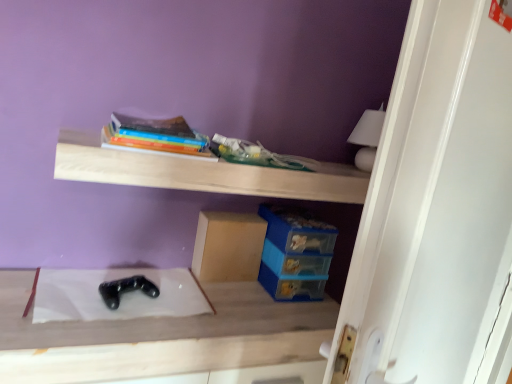
Where is `free spot in front of matte cardboard box at center`? This screenshot has width=512, height=384. free spot in front of matte cardboard box at center is located at coordinates (233, 297).